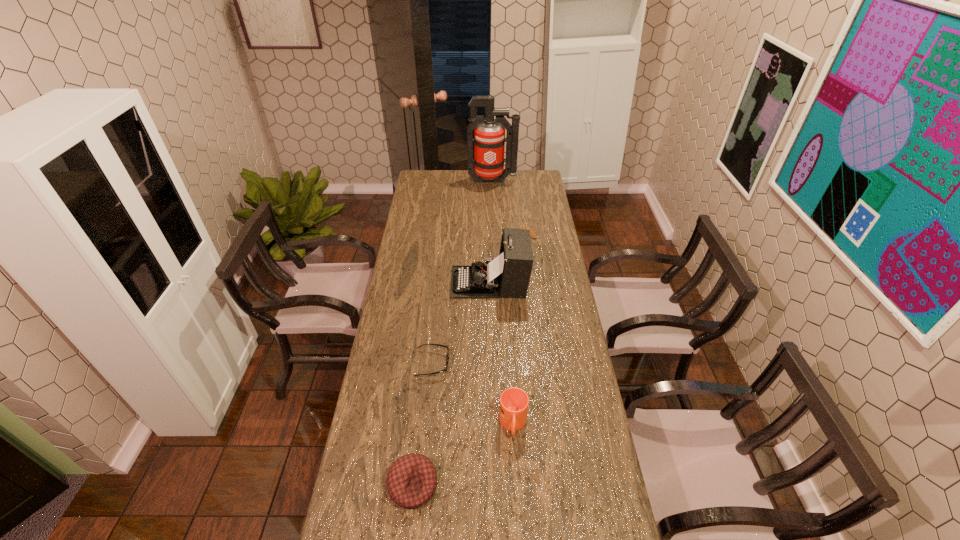
The width and height of the screenshot is (960, 540). Find the location of `object located in the far edge section of the desktop`. object located in the far edge section of the desktop is located at coordinates (489, 139).

You are a GUI agent. You are given a task and a screenshot of the screen. Output one action in this format:
    pyautogui.click(x=<x>, y=<y>)
    Task: Click on the beanbag that is at the left edge
    Image resolution: width=960 pixels, height=540 pixels.
    Given the screenshot: What is the action you would take?
    pyautogui.click(x=411, y=481)

Find the location of a particular element. This screenshot has width=960, height=540. sunglasses that is at the left edge is located at coordinates (447, 362).

Image resolution: width=960 pixels, height=540 pixels. I want to click on object positioned at the right edge, so click(x=532, y=233).

Where is `vacant space at the far edge of the desktop`? This screenshot has height=540, width=960. vacant space at the far edge of the desktop is located at coordinates (444, 189).

The width and height of the screenshot is (960, 540). Find the location of `blank space at the left edge of the desktop`. blank space at the left edge of the desktop is located at coordinates (413, 326).

Image resolution: width=960 pixels, height=540 pixels. In the image, there is a desktop. What are the coordinates of `free region at the right edge` in the screenshot? It's located at (546, 251).

In order to click on free space at the far left corner of the desktop in this screenshot , I will do pos(422,177).

Locate an element on the screen. The image size is (960, 540). free space at the far right corner is located at coordinates 540,181.

Locate an element on the screen. free space between the third nearest object and the fourth tallest object is located at coordinates (423, 424).